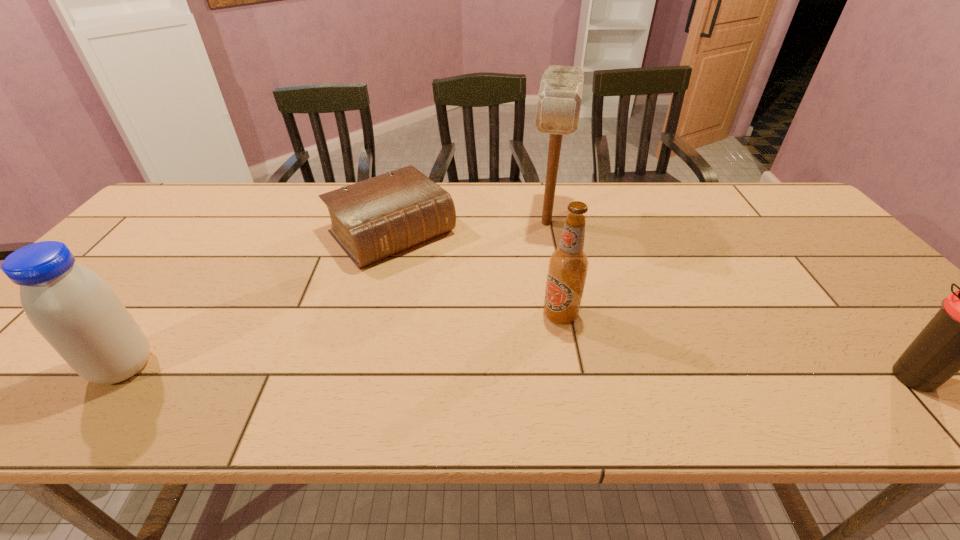
At what (x,y) coordinates should I click in order to perform the action: click on free spot between the soya milk and the mallet. Please return your answer as a coordinate pair (x, y). This screenshot has height=540, width=960. Looking at the image, I should click on (335, 295).

The width and height of the screenshot is (960, 540). I want to click on vacant area between the third nearest object and the soya milk, so click(x=342, y=341).

Locate an element on the screen. This screenshot has width=960, height=540. free space between the leftmost object and the fourth tallest object is located at coordinates (518, 373).

In order to click on vacant area that lies between the shortest object and the tallest object in this screenshot , I will do `click(469, 228)`.

You are a GUI agent. You are given a task and a screenshot of the screen. Output one action in this format:
    pyautogui.click(x=<x>, y=<y>)
    Task: Click on the empty space between the Bible and the third nearest object
    This screenshot has height=540, width=960.
    Given the screenshot: What is the action you would take?
    pyautogui.click(x=476, y=274)

Where is `vacant area that lies between the rightmost object and the soya milk`? This screenshot has width=960, height=540. vacant area that lies between the rightmost object and the soya milk is located at coordinates (518, 373).

Image resolution: width=960 pixels, height=540 pixels. I want to click on free space between the thermos bottle and the leftmost object, so click(x=518, y=373).

Locate an element on the screen. The image size is (960, 540). vacant space that is in between the beer bottle and the thermos bottle is located at coordinates (736, 346).

Identify the location of object that stands as the closest to the tallest object. This screenshot has height=540, width=960. 371,220.

Locate which object is the second closest to the beer bottle. Please provide its 2D coordinates. Your answer should be formatted as a tuple, i.e. [(x, y)], where the tuple contains the x and y coordinates of a point satisfying the conditions above.

[(371, 220)]